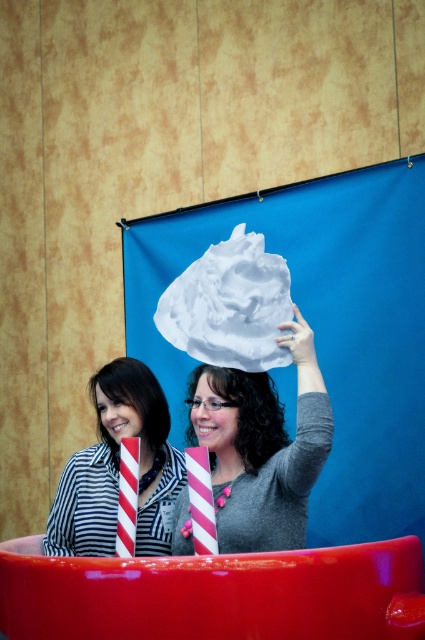
Can you confirm if striped fabric shirt at left is positioned to the right of white matte foam at upper center?

Incorrect, striped fabric shirt at left is not on the right side of white matte foam at upper center.

Who is shorter, striped fabric shirt at left or white matte foam at upper center?

With less height is white matte foam at upper center.

Who is more forward, [70,540] or [249,241]?

Point [249,241] is in front.

Locate an element on the screen. striped fabric shirt at left is located at coordinates (119, 468).

Does point (181, 337) come in front of point (141, 397)?

Yes, point (181, 337) is closer to viewer.

The image size is (425, 640). In order to click on white matte foam at upper center in this screenshot , I will do `click(229, 305)`.

Looking at this image, does white matte cloud at upper center have a greater height compared to smooth black hair at center?

No.

What do you see at coordinates (246, 410) in the screenshot? I see `white matte cloud at upper center` at bounding box center [246, 410].

Locate an element on the screen. The image size is (425, 640). white matte cloud at upper center is located at coordinates (246, 410).